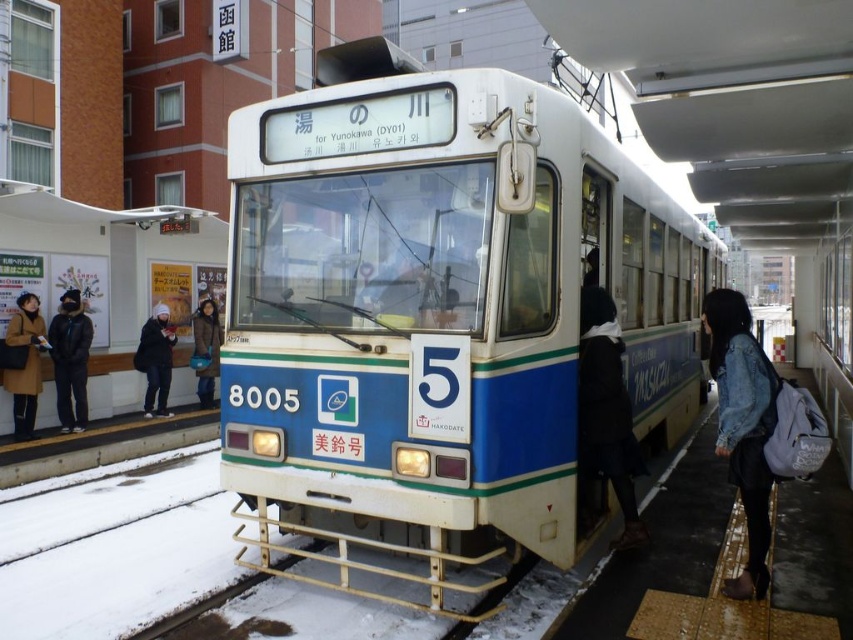
Who is more forward, (714, 372) or (25, 424)?

Point (714, 372)

Does denim jacket at lower right have a larger size compared to brown leather coat at left?

Indeed, denim jacket at lower right has a larger size compared to brown leather coat at left.

Does point (704, 314) come behind point (38, 355)?

No, it is not.

In order to click on denim jacket at lower right in this screenshot , I will do `click(743, 426)`.

Is blue matte train at center below brown leather coat at left?

No.

Is blue matte train at center closer to the viewer compared to brown leather coat at left?

Yes, blue matte train at center is in front of brown leather coat at left.

Is point (306, 477) more distant than point (25, 344)?

That is False.

Locate an element on the screen. blue matte train at center is located at coordinates (439, 312).

Is blue matte train at center closer to camera compared to denim jacket at lower right?

Yes, it is.

Does blue matte train at center have a lesser height compared to denim jacket at lower right?

Incorrect, blue matte train at center's height does not fall short of denim jacket at lower right's.

This screenshot has height=640, width=853. What do you see at coordinates (439, 312) in the screenshot?
I see `blue matte train at center` at bounding box center [439, 312].

Where is `blue matte train at center`? blue matte train at center is located at coordinates (439, 312).